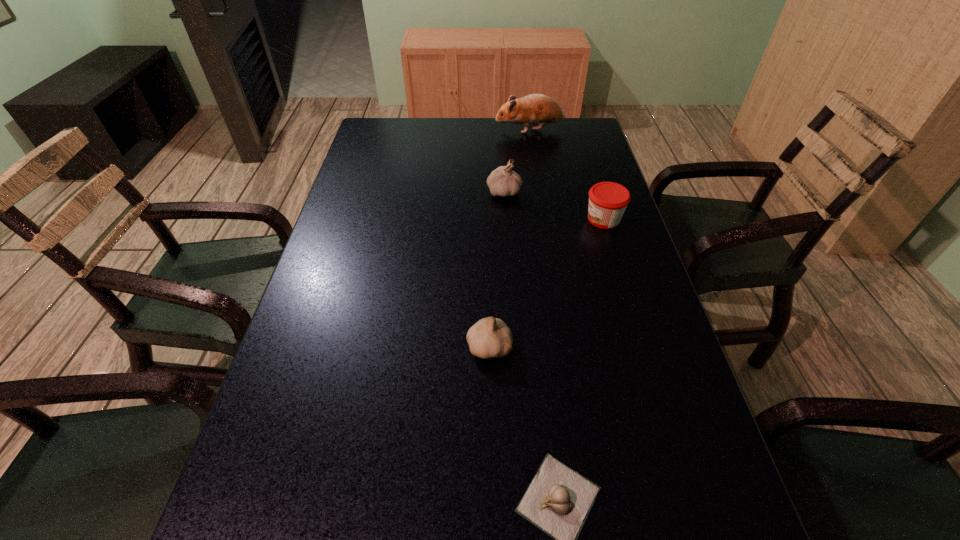
Where is `blank space located on the label side of the jam`? blank space located on the label side of the jam is located at coordinates (437, 219).

You are a GUI agent. You are given a task and a screenshot of the screen. Output one action in this format:
    pyautogui.click(x=<x>, y=<y>)
    Task: Click on the free location located 0.200m on the label side of the jam
    The width and height of the screenshot is (960, 540).
    Given the screenshot: What is the action you would take?
    pyautogui.click(x=509, y=219)

The image size is (960, 540). Identify the location of free space located on the label side of the jam. (497, 219).

This screenshot has height=540, width=960. I want to click on free point located 0.310m on the left of the second tallest garlic, so click(312, 347).

Where is `object at the far edge`? object at the far edge is located at coordinates (535, 109).

You are a GUI agent. You are given a task and a screenshot of the screen. Output one action in this format:
    pyautogui.click(x=<x>, y=<y>)
    Task: Click on the hamster that is at the right edge
    
    Given the screenshot: What is the action you would take?
    pyautogui.click(x=535, y=109)

Image resolution: width=960 pixels, height=540 pixels. What are the coordinates of `jam situated at the right edge` in the screenshot? It's located at (607, 200).

Locate an element on the screen. object that is at the far right corner is located at coordinates (535, 109).

The image size is (960, 540). In the image, there is a desktop. Find the location of `vacant space at the far edge`. vacant space at the far edge is located at coordinates (502, 128).

In the image, there is a desktop. Identify the location of free region at the left edge. The height and width of the screenshot is (540, 960). (373, 178).